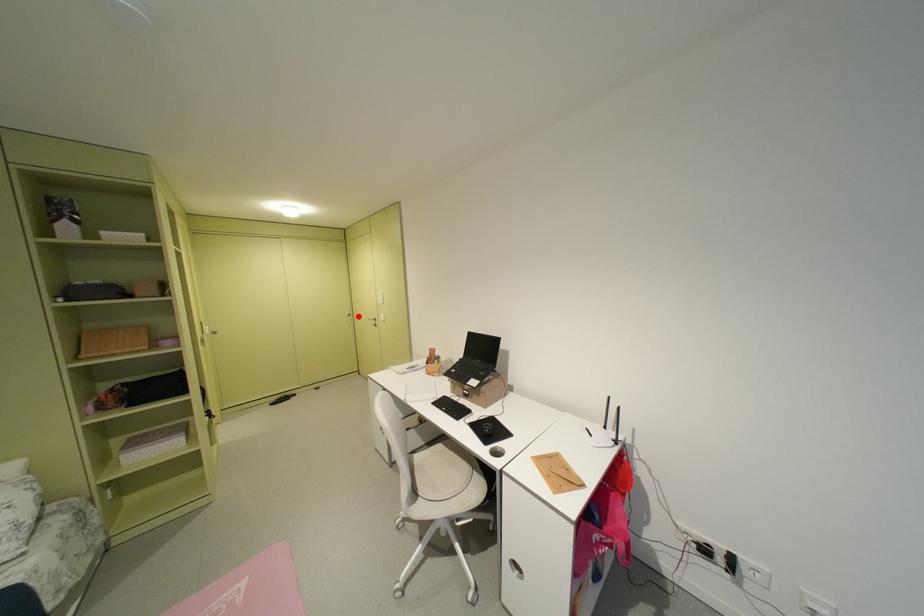
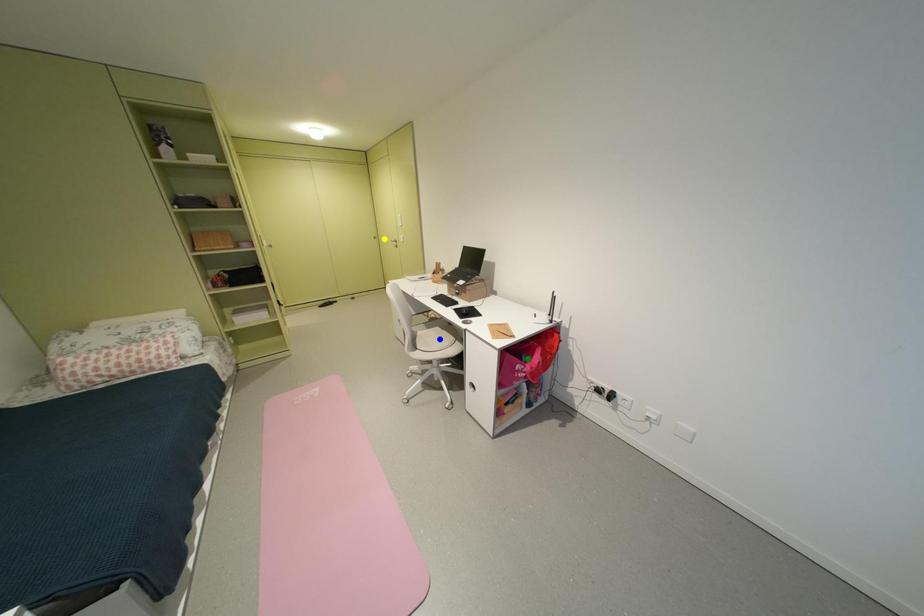
Question: I am providing you with two images of the same scene from different viewpoints. A red point is marked on the first image. You are given multiple points on the second image. Which spot in image 2 lines up with the point in image 1?

Choices:
 (A) green point
 (B) blue point
 (C) yellow point

Answer: (C)